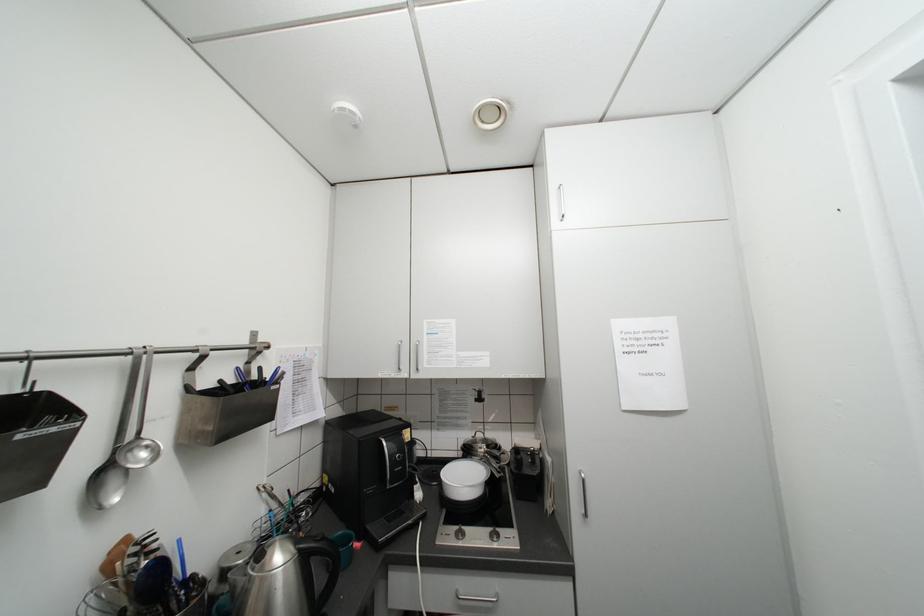
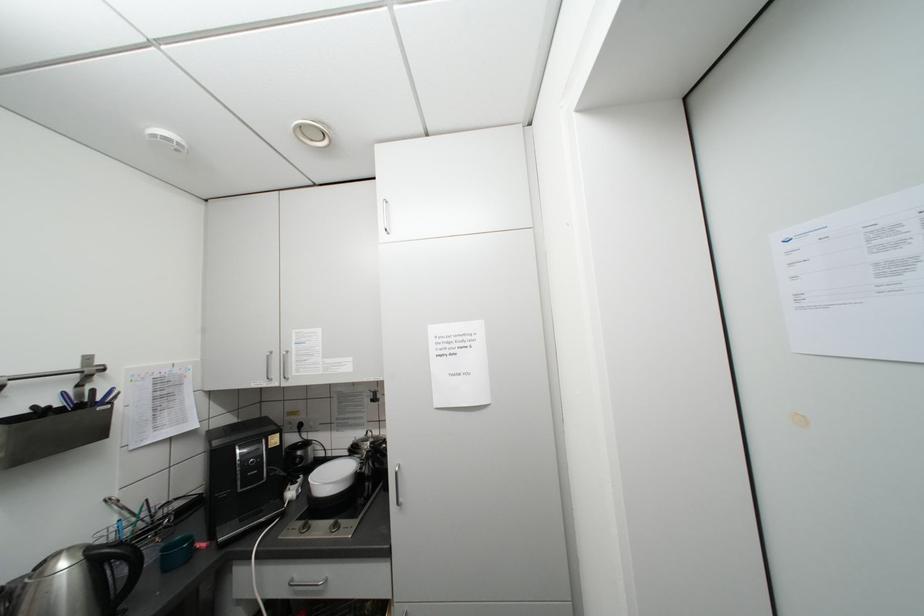
Question: The images are taken continuously from a first-person perspective. In which direction are you moving?

Choices:
 (A) Left
 (B) Right
 (C) Forward
 (D) Backward

Answer: (B)